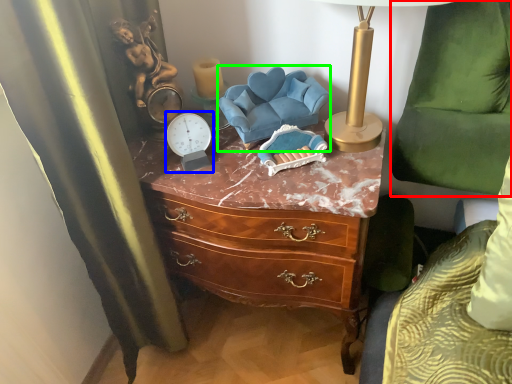
Question: Estimate the real-world distances between objects in this image. Which object is closer to swivel chair (highlighted by a red box), clock (highlighted by a blue box) or swivel chair (highlighted by a green box)?

Choices:
 (A) clock
 (B) swivel chair

Answer: (B)